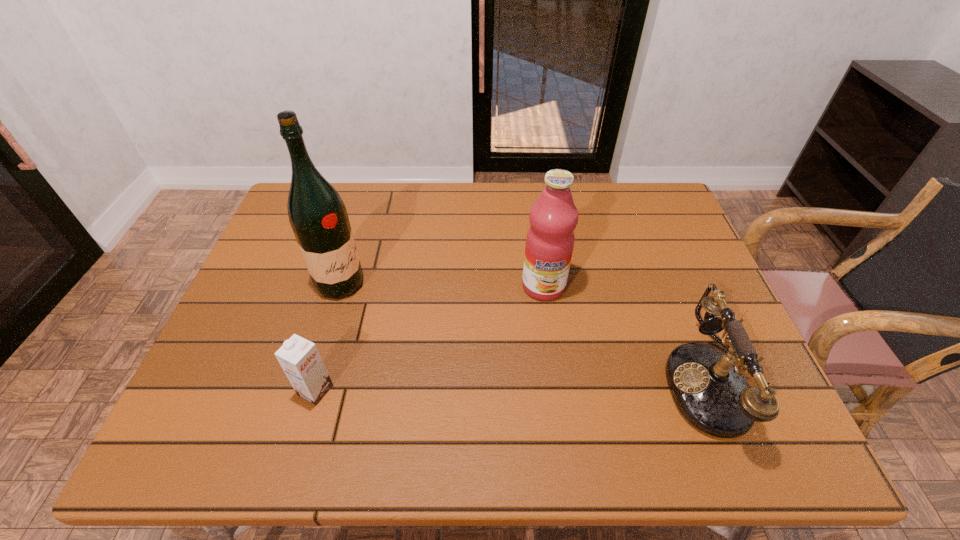
Where is `free spot on the desktop that is between the shortest object and the rightmost object and is positioned on the label of the fruit juice`? The height and width of the screenshot is (540, 960). free spot on the desktop that is between the shortest object and the rightmost object and is positioned on the label of the fruit juice is located at coordinates (544, 386).

Locate an element on the screen. vacant space on the desktop that is between the chocolate milk and the third tallest object and is positioned on the front-facing side of the tallest object is located at coordinates (550, 386).